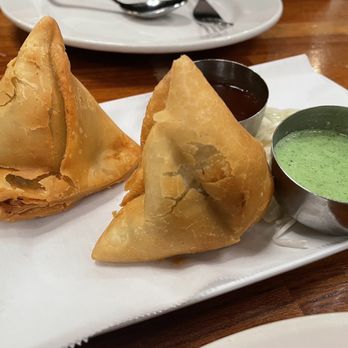
Locate an element on the screen. The height and width of the screenshot is (348, 348). fork is located at coordinates (215, 11).